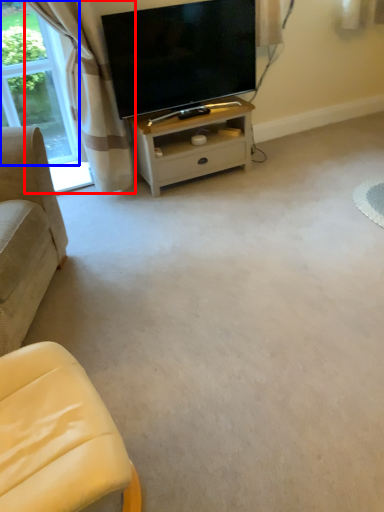
Question: Among these objects, which one is nearest to the camera, curtain (highlighted by a red box) or bay window (highlighted by a blue box)?

Choices:
 (A) curtain
 (B) bay window

Answer: (A)